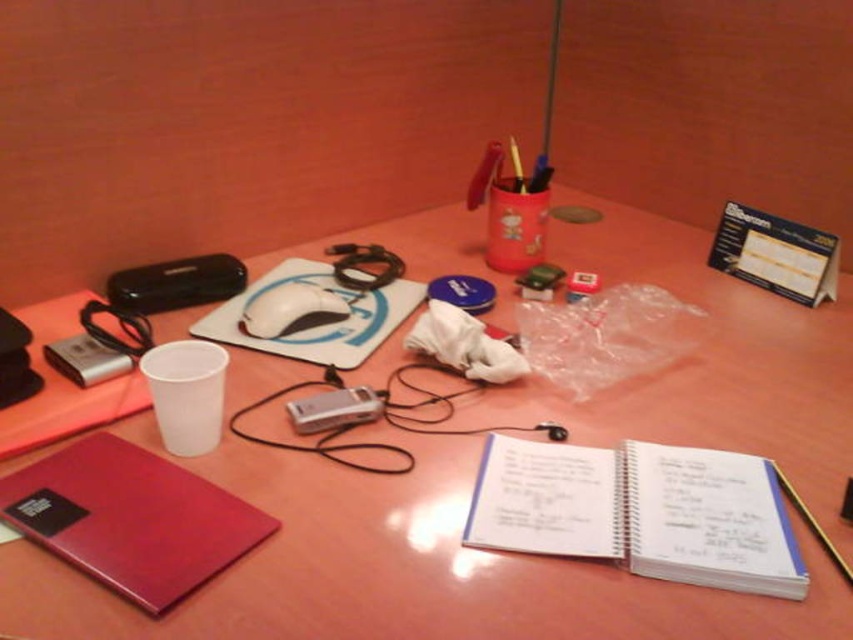
Question: Which object is positioned closest to the matte red notebook at lower left?

Choices:
 (A) silver metallic camera at center
 (B) white paper notebook at center

Answer: (A)

Question: In this image, where is white paper notebook at center located relative to silver metallic camera at center?

Choices:
 (A) above
 (B) below

Answer: (B)

Question: Which object is closer to the camera taking this photo?

Choices:
 (A) white plastic cup at upper left
 (B) matte red notebook at lower left

Answer: (A)

Question: Does white plastic cup at upper left appear under silver metallic camera at center?

Choices:
 (A) yes
 (B) no

Answer: (B)

Question: Can you confirm if white paper notebook at center is positioned above matte red notebook at lower left?

Choices:
 (A) no
 (B) yes

Answer: (A)

Question: Which point appears farthest from the camera in this image?

Choices:
 (A) (265, 326)
 (B) (350, 397)
 (C) (62, 500)

Answer: (A)